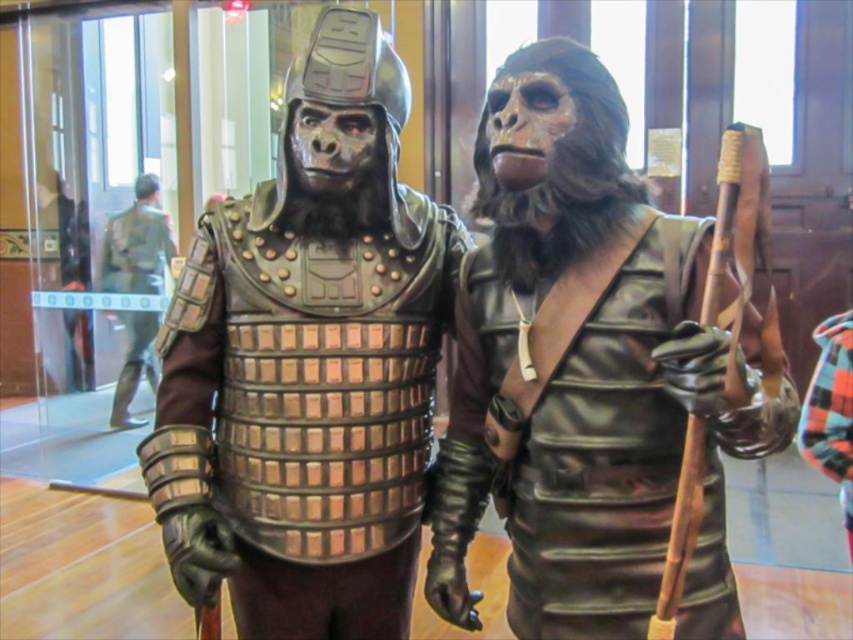
You are standing in front of the two figures. The metallic armor at center is located at point (308, 364). Can you tell me which direction the metallic armor at center is facing relative to the other figure?

The metallic armor at center is facing the same direction as the other figure since they are both positioned facing forward in the image.

In the scene shown: You are a photographer standing at a certain position. You want to capture a closeup shot of the metallic armor at center without any other objects in the frame. Given that your camera can focus clearly on objects within a 3.5 feet range, will you be able to achieve this?

The metallic armor at center is 4.04 feet away from the camera, which is beyond the 3.5 feet focus range. Therefore, you won the camera cannot focus clearly on the metallic armor at center for a closeup shot.

You are an observer positioned at the origin point of the image. The metallic armor at center is located at coordinates. Can you tell me its exact coordinates?

The metallic armor at center is located at the coordinates of point (308, 364).